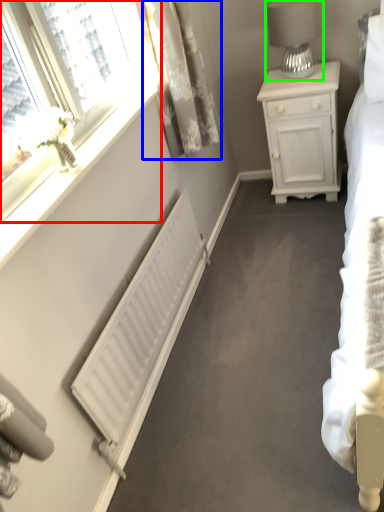
Question: Which object is the farthest from window (highlighted by a red box)? Choose among these: curtain (highlighted by a blue box) or table lamp (highlighted by a green box).

Choices:
 (A) curtain
 (B) table lamp

Answer: (B)